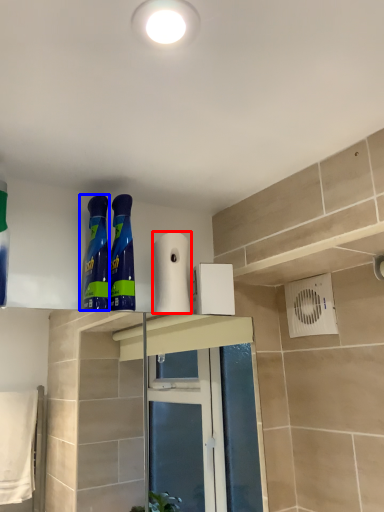
Question: Which point is closer to the camera, toilet paper (highlighted by a red box) or cleaning product (highlighted by a blue box)?

Choices:
 (A) toilet paper
 (B) cleaning product

Answer: (B)